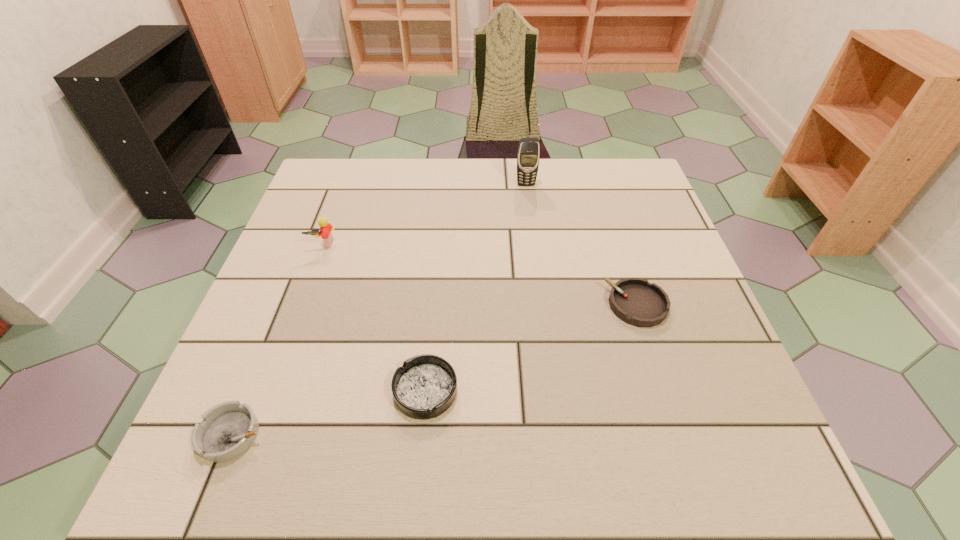
This screenshot has height=540, width=960. In order to click on vacant space positioned on the back of the farthest ashtray in this screenshot , I will do `click(607, 214)`.

The width and height of the screenshot is (960, 540). Identify the location of vacant region located 0.240m on the right of the second ashtray from right to left. (589, 391).

This screenshot has height=540, width=960. What are the coordinates of `vacant position located on the back of the leftmost ashtray` in the screenshot? It's located at (290, 294).

Locate an element on the screen. The height and width of the screenshot is (540, 960). object that is at the far edge is located at coordinates (528, 156).

At what (x,y) coordinates should I click in order to perform the action: click on object that is at the near edge. Please return your answer as a coordinate pair (x, y). The width and height of the screenshot is (960, 540). Looking at the image, I should click on (228, 429).

The image size is (960, 540). Find the location of `Lego situated at the left edge`. Lego situated at the left edge is located at coordinates (325, 228).

Where is `ashtray located in the left edge section of the desktop`? The image size is (960, 540). ashtray located in the left edge section of the desktop is located at coordinates (228, 429).

I want to click on object situated at the right edge, so click(635, 301).

Where is `object positioned at the near left corner`? This screenshot has height=540, width=960. object positioned at the near left corner is located at coordinates click(228, 429).

Locate an element on the screen. The image size is (960, 540). free space at the far edge of the desktop is located at coordinates (458, 171).